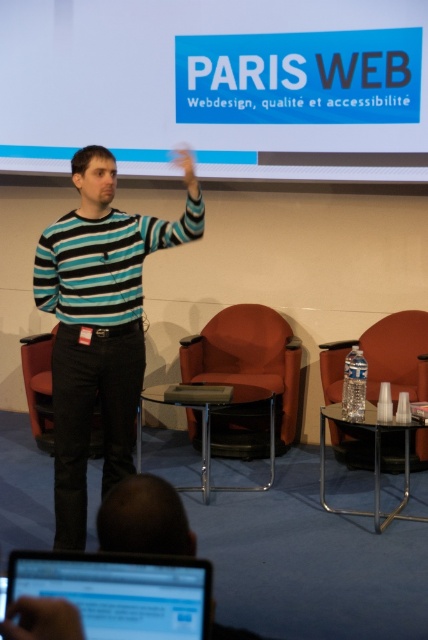
Between matte black laptop at lower left and orange fabric armchair at right, which one has less height?

matte black laptop at lower left is shorter.

Based on the photo, does matte black laptop at lower left have a lesser height compared to orange fabric armchair at right?

Indeed, matte black laptop at lower left has a lesser height compared to orange fabric armchair at right.

Is point (142, 612) more distant than point (407, 348)?

No, (142, 612) is closer to viewer.

Identify the location of matte black laptop at lower left. (121, 592).

The image size is (428, 640). Describe the element at coordinates (214, 84) in the screenshot. I see `blue plastic projection screen at upper center` at that location.

Which is behind, point (293, 144) or point (258, 358)?

The point (258, 358) is behind.

The image size is (428, 640). Find the location of `blue plastic projection screen at upper center`. blue plastic projection screen at upper center is located at coordinates (214, 84).

Does matte black laptop at lower left appear on the left side of matte black hand at upper center?

In fact, matte black laptop at lower left is to the right of matte black hand at upper center.

Can you confirm if matte black laptop at lower left is smaller than matte black hand at upper center?

Yes, matte black laptop at lower left is smaller than matte black hand at upper center.

Who is more forward, [166,572] or [193,157]?

Point [166,572]

The image size is (428, 640). Find the location of `matte black laptop at lower left`. matte black laptop at lower left is located at coordinates (121, 592).